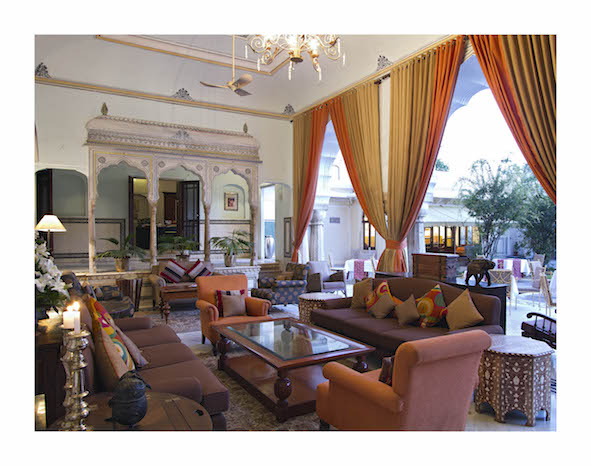
Where is `seat cushions on brown sofa`? seat cushions on brown sofa is located at coordinates (155, 330), (164, 346), (181, 365), (335, 310), (359, 319), (402, 334).